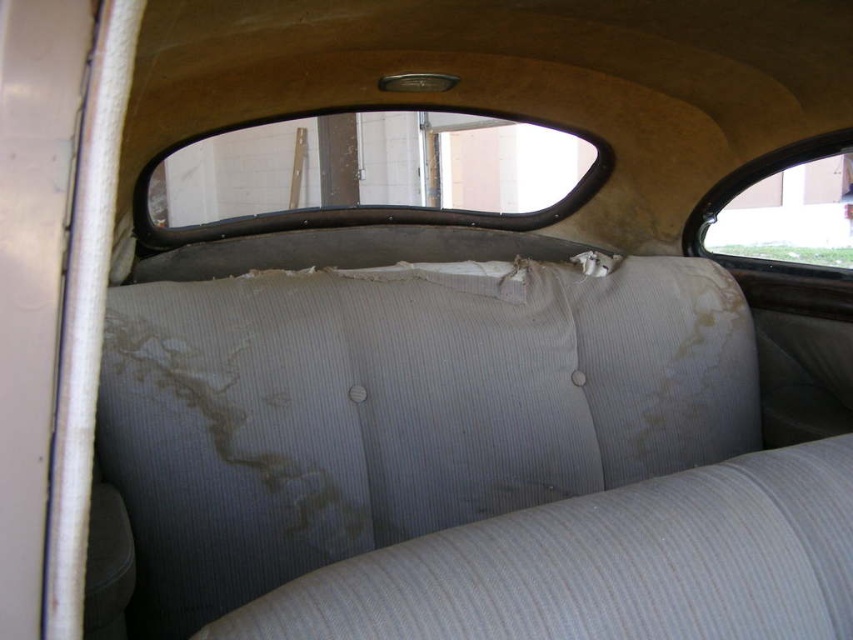
Is clear glass window at upper center positioned before clear glass window at upper right?

Yes.

Between clear glass window at upper center and clear glass window at upper right, which one is positioned lower?

clear glass window at upper right is below.

Is point (358, 136) positioned behind point (828, 234)?

Yes, it is.

Locate an element on the screen. The image size is (853, 640). clear glass window at upper center is located at coordinates (373, 173).